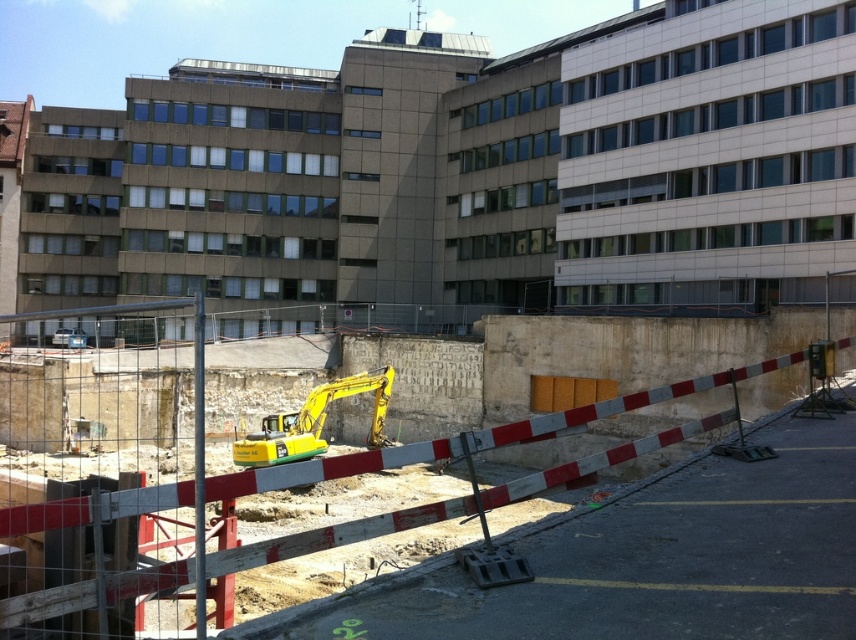
Is yellow metal excavator at center to the right of yellow metallic excavator at center from the viewer's perspective?

Indeed, yellow metal excavator at center is positioned on the right side of yellow metallic excavator at center.

Can you confirm if yellow metal excavator at center is smaller than yellow metallic excavator at center?

No.

Which is behind, point (167, 572) or point (242, 465)?

The point (242, 465) is behind.

At what (x,y) coordinates should I click in order to perform the action: click on yellow metal excavator at center. Please return your answer as a coordinate pair (x, y). This screenshot has height=640, width=856. Looking at the image, I should click on (177, 508).